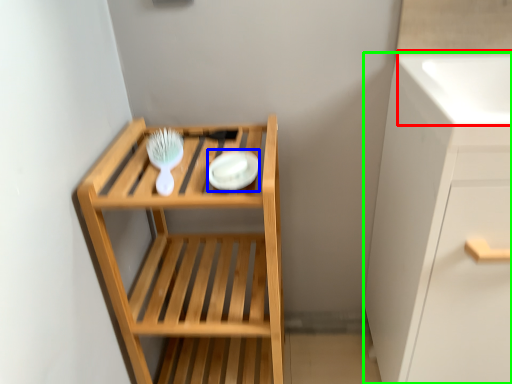
Question: Which object is the closest to the sink (highlighted by a red box)? Choose among these: platter (highlighted by a blue box) or cabinetry (highlighted by a green box).

Choices:
 (A) platter
 (B) cabinetry

Answer: (B)